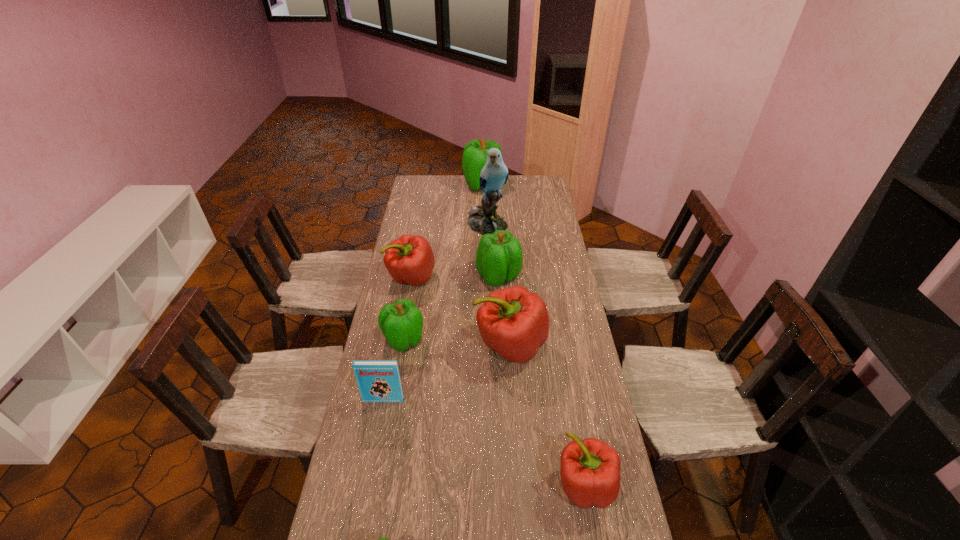
At what (x,y) coordinates should I click in order to perform the action: click on vacant area located on the back of the smallest pink bell pepper. Please return your answer as a coordinate pair (x, y). This screenshot has width=960, height=540. Looking at the image, I should click on coord(562,351).

Locate an element on the screen. The width and height of the screenshot is (960, 540). object at the far edge is located at coordinates (474, 158).

Image resolution: width=960 pixels, height=540 pixels. Identify the location of book that is at the left edge. (379, 381).

In the image, there is a desktop. Where is `vacant space at the left edge`? Image resolution: width=960 pixels, height=540 pixels. vacant space at the left edge is located at coordinates (418, 206).

In the image, there is a desktop. Find the location of `vacant region at the right edge`. vacant region at the right edge is located at coordinates (545, 210).

This screenshot has width=960, height=540. In the image, there is a desktop. What are the coordinates of `free space at the far right corner` in the screenshot? It's located at (523, 184).

This screenshot has width=960, height=540. In order to click on vacant space in between the blue book and the nearest pink bell pepper in this screenshot , I will do click(484, 443).

Image resolution: width=960 pixels, height=540 pixels. In order to click on blank region between the leftmost pink bell pepper and the tallest object in this screenshot , I will do `click(449, 252)`.

I want to click on free area in between the second smallest green bell pepper and the second biggest green bell pepper, so click(x=451, y=308).

Where is `free area in between the parakeet and the second smallest pink bell pepper`? The height and width of the screenshot is (540, 960). free area in between the parakeet and the second smallest pink bell pepper is located at coordinates (449, 252).